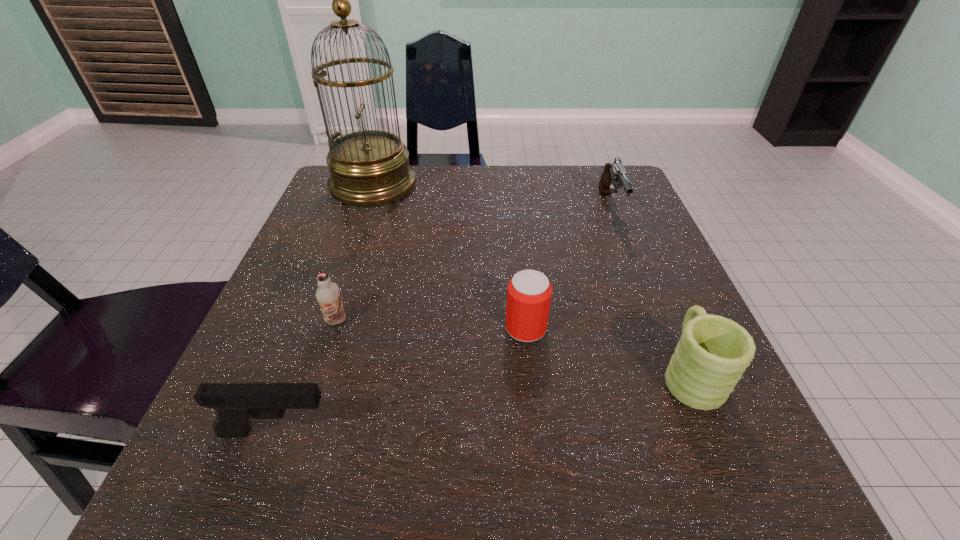
You are a GUI agent. You are given a task and a screenshot of the screen. Output one action in this format:
    pyautogui.click(x=<x>, y=<y>)
    Task: Click on the empty location between the chocolate milk and the tallest object
    The image size is (960, 540).
    Given the screenshot: What is the action you would take?
    pyautogui.click(x=355, y=253)

Where is `vacant area that lies between the chocolate milk and the tallest object`? vacant area that lies between the chocolate milk and the tallest object is located at coordinates click(x=355, y=253).

Identify which object is the fourth nearest to the right pistol. Please provide its 2D coordinates. Your answer should be formatted as a tuple, i.e. [(x, y)], where the tuple contains the x and y coordinates of a point satisfying the conditions above.

[(328, 294)]

Image resolution: width=960 pixels, height=540 pixels. In order to click on object identified as the fourth closest to the birdcage in this screenshot , I will do `click(235, 403)`.

The image size is (960, 540). I want to click on free location that satisfies the following two spatial constraints: 1. with an open door on the tallest object; 2. on the back side of the beer can, so click(x=324, y=328).

The width and height of the screenshot is (960, 540). I want to click on vacant space that satisfies the following two spatial constraints: 1. on the front side of the chocolate milk; 2. on the front-facing side of the left pistol, so click(x=300, y=432).

Where is `vacant region that satisfies the following two spatial constraints: 1. at the barrel of the right pistol; 2. on the front-facing side of the nearest object`? The image size is (960, 540). vacant region that satisfies the following two spatial constraints: 1. at the barrel of the right pistol; 2. on the front-facing side of the nearest object is located at coordinates (699, 432).

I want to click on vacant space that satisfies the following two spatial constraints: 1. with an open door on the birdcage; 2. on the right side of the fourth object from left to right, so click(x=324, y=328).